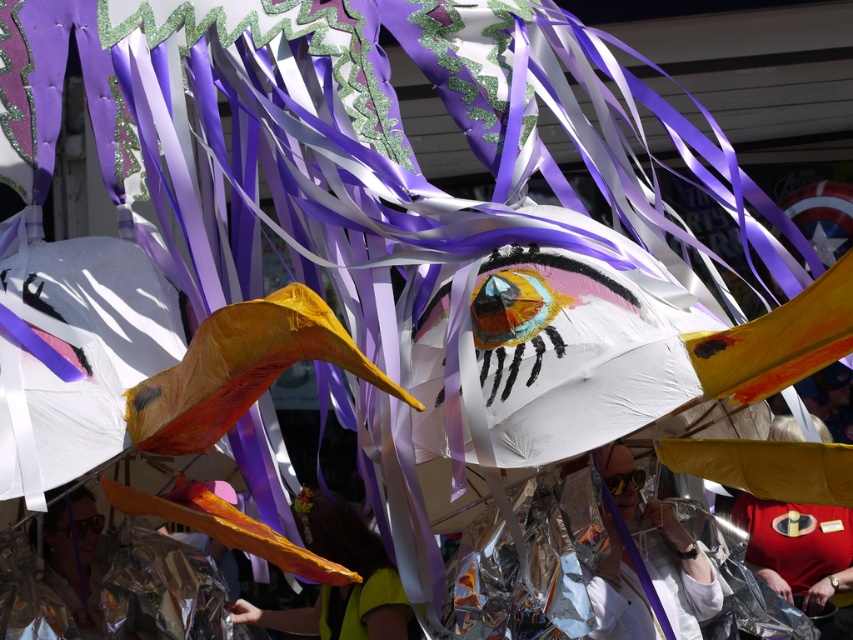
Question: Which of the following is the closest to the observer?

Choices:
 (A) (334, 515)
 (B) (637, 528)

Answer: (B)

Question: Which of these objects is positioned farthest from the yellow fabric at center?

Choices:
 (A) red fabric shirt at lower right
 (B) shiny metallic mask at center

Answer: (A)

Question: Which point appears closest to the camera in this image?

Choices:
 (A) (607, 588)
 (B) (793, 573)
 (C) (405, 625)

Answer: (A)

Question: From the image, what is the correct spatial relationship of shiny metallic mask at center in relation to yellow fabric at center?

Choices:
 (A) left
 (B) right

Answer: (B)

Question: Does shiny metallic mask at center have a greater width compared to yellow fabric at center?

Choices:
 (A) yes
 (B) no

Answer: (B)

Question: Where is shiny metallic mask at center located in relation to yellow fabric at center in the image?

Choices:
 (A) left
 (B) right

Answer: (B)